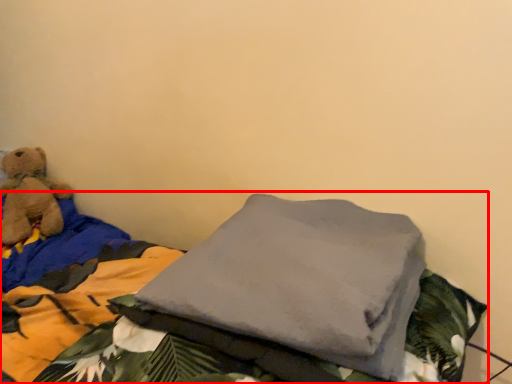
Question: From the image's perspective, what is the correct spatial positioning of bed (annotated by the red box) in reference to teddy bear?

Choices:
 (A) below
 (B) above

Answer: (A)